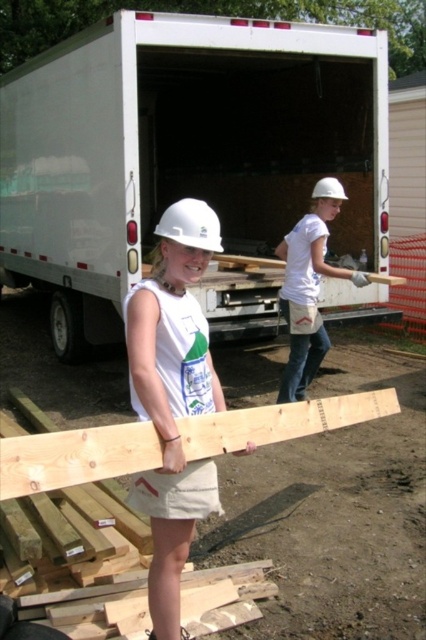
Question: Is white matte hard hat at center to the right of natural wood plank at center from the viewer's perspective?

Choices:
 (A) yes
 (B) no

Answer: (B)

Question: Estimate the real-world distances between objects in this image. Which object is farther from the white matte hard hat at upper center?

Choices:
 (A) white matte truck at center
 (B) white hard hat at center
 (C) white matte hard hat at center

Answer: (B)

Question: Does white matte hard hat at center appear on the right side of white matte hard hat at upper center?

Choices:
 (A) no
 (B) yes

Answer: (A)

Question: Is white matte truck at center thinner than white hard hat at center?

Choices:
 (A) yes
 (B) no

Answer: (B)

Question: Estimate the real-world distances between objects in this image. Which object is farther from the white matte hard hat at upper center?

Choices:
 (A) natural wood plank at center
 (B) white matte truck at center
 (C) white matte hard hat at center
 (D) white hard hat at center

Answer: (D)

Question: Which object is the farthest from the white hard hat at center?

Choices:
 (A) white matte hard hat at center
 (B) white matte truck at center

Answer: (B)